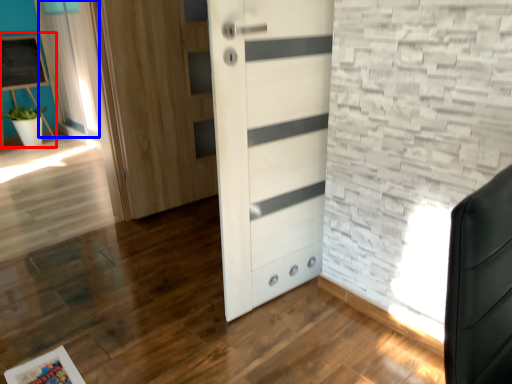
Question: Which object appears closest to the camera in this image, bulletin board (highlighted by a red box) or curtain (highlighted by a blue box)?

Choices:
 (A) bulletin board
 (B) curtain

Answer: (B)